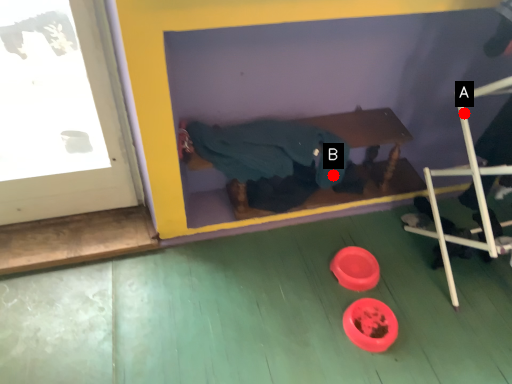
Question: Two points are circled on the image, labeled by A and B beside each circle. Which point is closer to the camera taking this photo?

Choices:
 (A) A is closer
 (B) B is closer

Answer: (A)